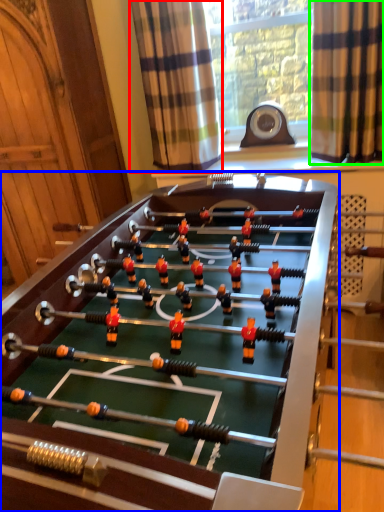
Question: Which object is the farthest from curtain (highlighted by a red box)? Choose among these: table (highlighted by a blue box) or curtain (highlighted by a green box).

Choices:
 (A) table
 (B) curtain

Answer: (A)